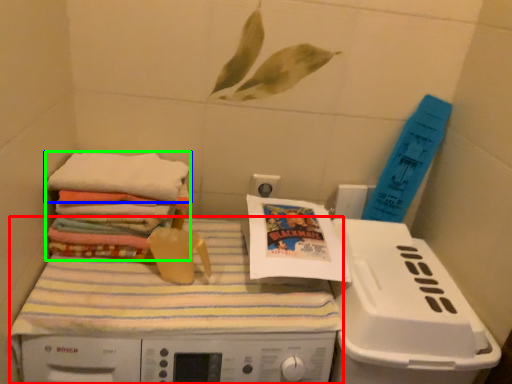
Question: Which is nearer to the machine (highlighted by a red box)? towel (highlighted by a blue box) or material (highlighted by a green box).

Choices:
 (A) towel
 (B) material

Answer: (B)